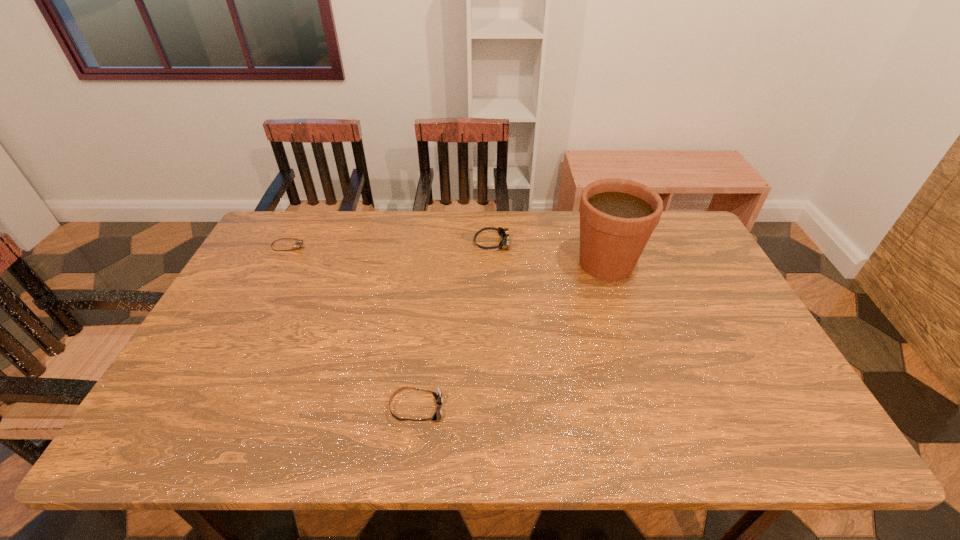
At what (x,y) coordinates should I click in order to perform the action: click on blank space that satisfies the following two spatial constraints: 1. on the front lenses and sides of the tallest object; 2. on the right side of the leftmost goggles. Please return your answer as a coordinate pair (x, y). The height and width of the screenshot is (540, 960). Looking at the image, I should click on (280, 264).